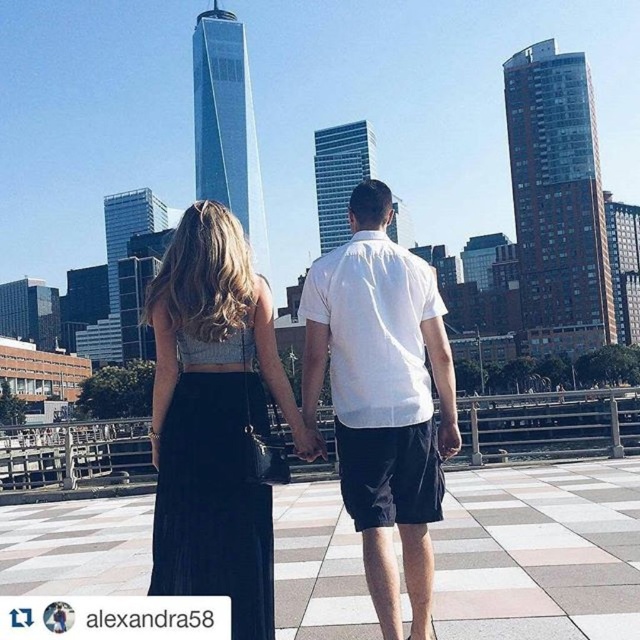
Question: Where is satin black skirt at center located in relation to white cotton shirt at center in the image?

Choices:
 (A) right
 (B) left

Answer: (B)

Question: Is satin black skirt at center above matte black hand at center?

Choices:
 (A) no
 (B) yes

Answer: (A)

Question: Which point is farther from the camera taking this photo?

Choices:
 (A) pos(346,432)
 (B) pos(305,433)

Answer: (B)

Question: Is satin black skirt at center above white cotton shirt at center?

Choices:
 (A) no
 (B) yes

Answer: (A)

Question: Which point is farther to the camera?

Choices:
 (A) white cotton shirt at center
 (B) satin black skirt at center

Answer: (A)

Question: Which of the following is the farthest from the observer?

Choices:
 (A) click(353, 484)
 (B) click(310, 444)

Answer: (B)